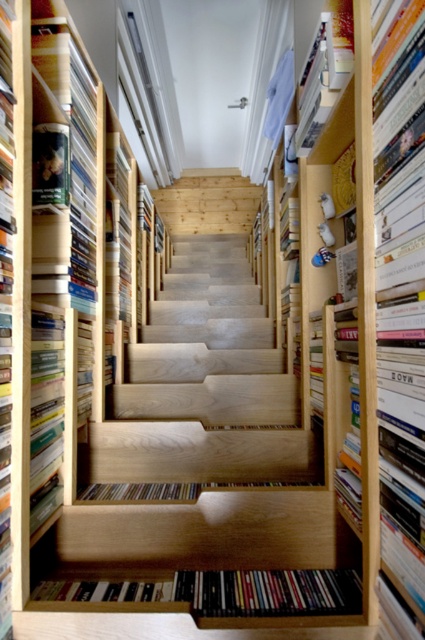
Question: Can you confirm if light brown wood bookshelf at center is positioned to the left of hardcover book at center?

Choices:
 (A) no
 (B) yes

Answer: (B)

Question: Does natural wood stairs at center lie behind hardcover book at center?

Choices:
 (A) yes
 (B) no

Answer: (A)

Question: Which point is closer to the camera?

Choices:
 (A) natural wood stairs at center
 (B) light brown wood bookshelf at center
 (C) hardcover book at center

Answer: (C)

Question: Among these objects, which one is nearest to the camera?

Choices:
 (A) hardcover book at center
 (B) natural wood stairs at center
 (C) light brown wood bookshelf at center

Answer: (A)

Question: Does natural wood stairs at center appear under light brown wood bookshelf at center?

Choices:
 (A) yes
 (B) no

Answer: (A)

Question: Which object is positioned closest to the light brown wood bookshelf at center?

Choices:
 (A) hardcover book at center
 (B) natural wood stairs at center

Answer: (B)